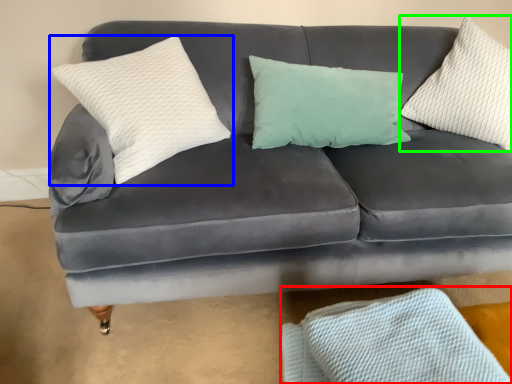
Question: Which object is the closest to the material (highlighted by a red box)? Choose among these: pillow (highlighted by a blue box) or pillow (highlighted by a green box).

Choices:
 (A) pillow
 (B) pillow

Answer: (A)